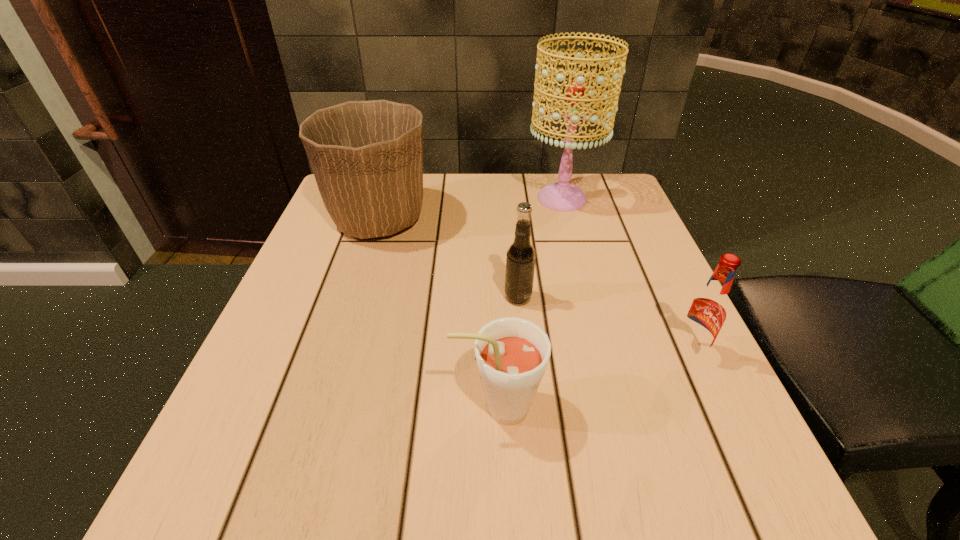
The height and width of the screenshot is (540, 960). Identify the location of the tallest object. (561, 196).

Where is `the second object from right to left`? Image resolution: width=960 pixels, height=540 pixels. the second object from right to left is located at coordinates (561, 196).

Locate an element on the screen. the leftmost object is located at coordinates (367, 156).

The width and height of the screenshot is (960, 540). What are the coordinates of `flowerpot` in the screenshot? It's located at (367, 156).

This screenshot has height=540, width=960. Identify the location of the farthest root beer. (520, 260).

The height and width of the screenshot is (540, 960). In order to click on the rightmost root beer in this screenshot , I will do `click(706, 313)`.

The width and height of the screenshot is (960, 540). In order to click on the second nearest root beer in this screenshot , I will do `click(706, 313)`.

At what (x,y) coordinates should I click in order to perform the action: click on the nearest root beer. Please return your answer as a coordinate pair (x, y). Looking at the image, I should click on (512, 353).

Find the location of `vacant area located on the left of the fourth object from left to right`. vacant area located on the left of the fourth object from left to right is located at coordinates (394, 198).

You are a GUI agent. You are given a task and a screenshot of the screen. Output one action in this format:
    pyautogui.click(x=<x>, y=<y>)
    Task: Click on the vacant area situated 0.050m on the back of the second tallest object
    
    Given the screenshot: What is the action you would take?
    pyautogui.click(x=390, y=183)